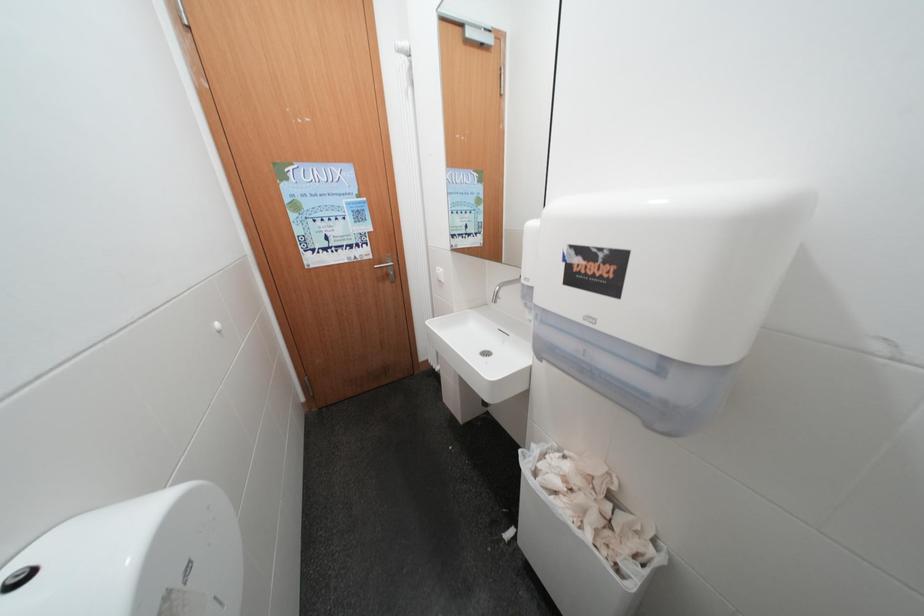
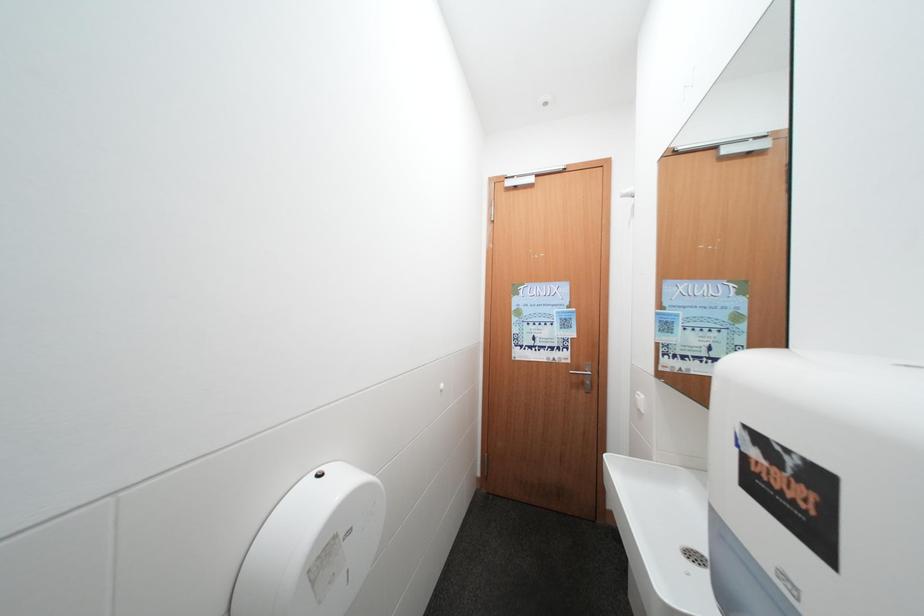
Question: The camera is either moving clockwise (left) or counter-clockwise (right) around the object. The first image is from the beginning of the video and the second image is from the end. Is the camera moving left or right when shooting the video?

Choices:
 (A) Left
 (B) Right

Answer: (B)